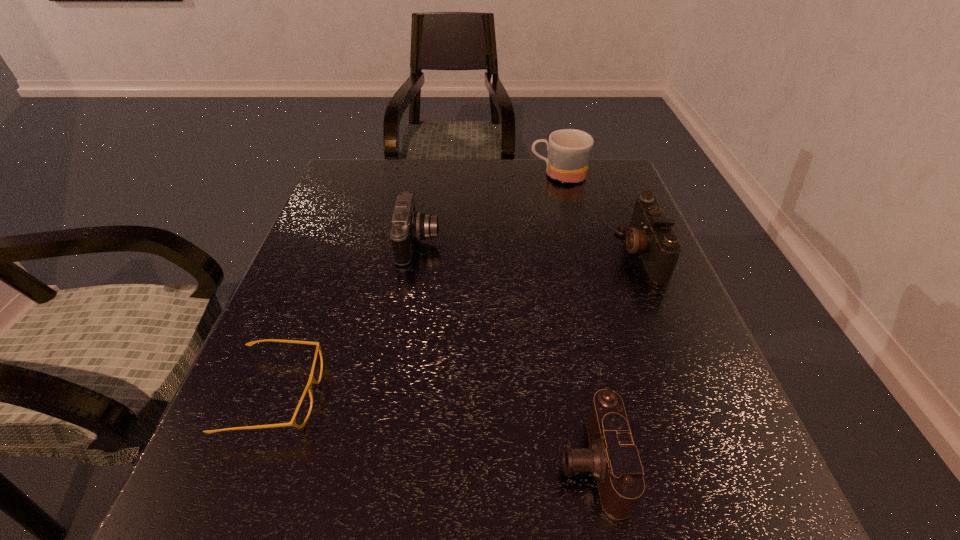
I want to click on free space between the rightmost object and the farthest object, so click(599, 214).

Locate an element on the screen. vacant area that lies between the farthest object and the rightmost object is located at coordinates (599, 214).

Identify the location of free space between the mug and the rightmost camera. (599, 214).

You are a GUI agent. You are given a task and a screenshot of the screen. Output one action in this format:
    pyautogui.click(x=<x>, y=<y>)
    Task: Click on the vacant space in between the spectacles and the rightmost camera
    Image resolution: width=960 pixels, height=540 pixels.
    Given the screenshot: What is the action you would take?
    pyautogui.click(x=458, y=324)

You are a GUI agent. You are given a task and a screenshot of the screen. Output one action in this format:
    pyautogui.click(x=<x>, y=<y>)
    Task: Click on the free space between the farthest object and the shortest object
    
    Given the screenshot: What is the action you would take?
    pyautogui.click(x=417, y=285)

Identify the location of unoccupied position between the leftmost camera and the second camera from left to right. (505, 353).

Where is `vacant space that is in between the leftmost camera and the shortest camera`? vacant space that is in between the leftmost camera and the shortest camera is located at coordinates (505, 353).

Identify the location of vacant point located between the rightmost object and the second object from left to right. The height and width of the screenshot is (540, 960). (530, 248).

Locate an element on the screen. The width and height of the screenshot is (960, 540). free space between the nearest camera and the second object from left to right is located at coordinates (505, 353).

Locate which object is the third closest to the leftmost object. Please provide its 2D coordinates. Your answer should be formatted as a tuple, i.e. [(x, y)], where the tuple contains the x and y coordinates of a point satisfying the conditions above.

[(650, 234)]